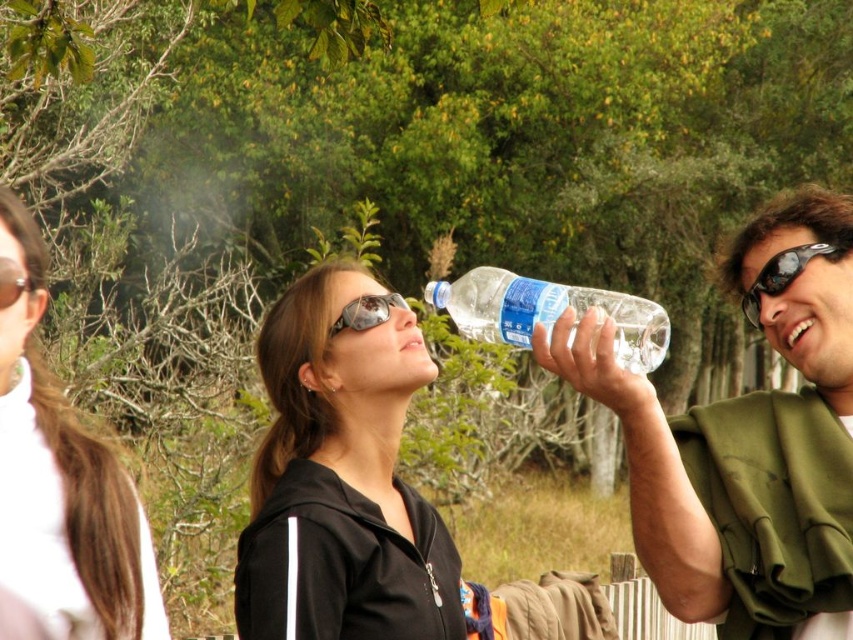
Question: Estimate the real-world distances between objects in this image. Which object is farther from the matte black goggles at upper center?

Choices:
 (A) sunglasses at center
 (B) black plastic sunglasses at upper right
 (C) black matte jacket at center
 (D) clear plastic bottle at upper center

Answer: (B)

Question: Can you confirm if sunglasses at center is positioned to the right of matte black goggles at upper center?

Choices:
 (A) yes
 (B) no

Answer: (A)

Question: Which object appears closest to the camera in this image?

Choices:
 (A) clear plastic bottle at upper center
 (B) matte green scarf at right
 (C) matte black goggles at upper center
 (D) sunglasses at center

Answer: (B)

Question: Which point appears closest to the camera in this image?

Choices:
 (A) (838, 490)
 (B) (399, 301)

Answer: (A)

Question: Is white fabric hair at upper left above black plastic sunglasses at upper right?

Choices:
 (A) yes
 (B) no

Answer: (B)

Question: Does white fabric hair at upper left lie behind black plastic sunglasses at upper right?

Choices:
 (A) no
 (B) yes

Answer: (A)